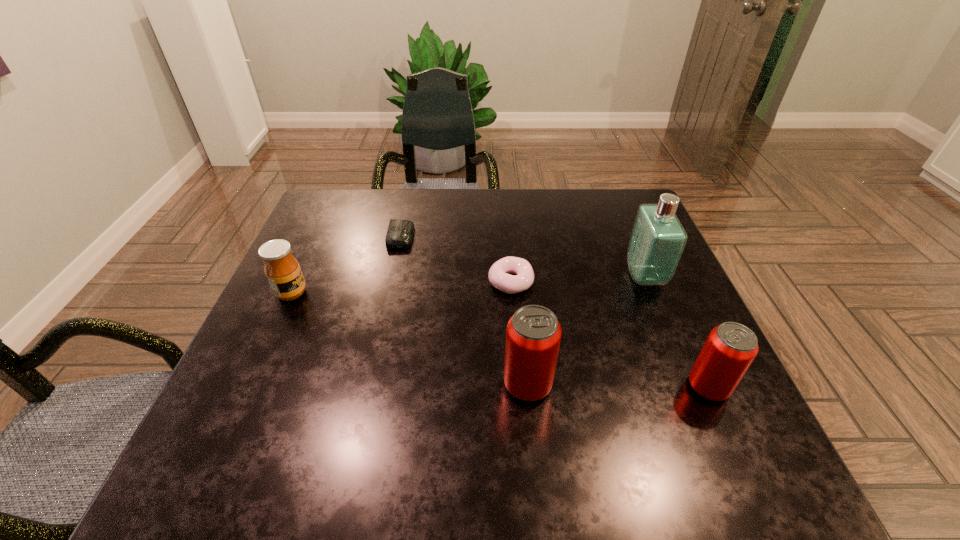
The image size is (960, 540). Identify the location of free space that is in between the alarm clock and the shorter can. click(x=555, y=312).

Identify the location of vacant space that's between the fifth object from right to left and the right can. (555, 312).

Identify the location of free spot between the taller can and the right can. (618, 386).

This screenshot has width=960, height=540. I want to click on unoccupied area between the doughnut and the shortest object, so click(x=456, y=259).

Locate an element on the screen. This screenshot has height=540, width=960. empty location between the shorter can and the perfume is located at coordinates (676, 332).

Identify the location of vacant region between the leftmost object and the right can. (x=500, y=340).

Find the location of a particular element. The height and width of the screenshot is (540, 960). free space between the shorter can and the left can is located at coordinates (618, 386).

Where is `the second closest object to the right can`? the second closest object to the right can is located at coordinates (533, 336).

Locate which object is the fourth closest to the perfume. Please provide its 2D coordinates. Your answer should be formatted as a tuple, i.e. [(x, y)], where the tuple contains the x and y coordinates of a point satisfying the conditions above.

[(399, 235)]

This screenshot has height=540, width=960. In order to click on vacant region that satisfies the following two spatial constraints: 1. on the display of the second object from left to right; 2. on the back side of the taller can in this screenshot , I will do `click(369, 385)`.